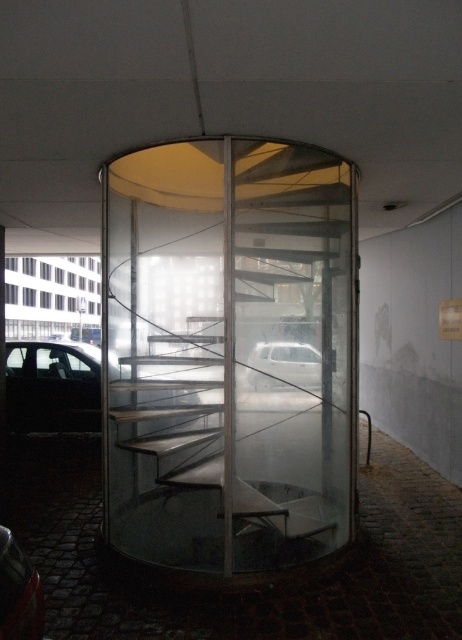
Question: Which object is positioned closest to the white matte car at center?

Choices:
 (A) transparent glass spiral staircase at center
 (B) matte black car at left
 (C) white glass parking garage at left

Answer: (B)

Question: Which object is farther from the camera taking this photo?

Choices:
 (A) matte black car at left
 (B) shiny red car at lower left
 (C) white matte car at center

Answer: (C)

Question: Can you confirm if transparent glass spiral staircase at center is bigger than shiny red car at lower left?

Choices:
 (A) no
 (B) yes

Answer: (B)

Question: Among these objects, which one is farthest from the camera?

Choices:
 (A) matte black car at left
 (B) shiny red car at lower left
 (C) white glass parking garage at left

Answer: (A)

Question: Does white glass parking garage at left appear on the right side of white matte car at center?

Choices:
 (A) no
 (B) yes

Answer: (A)

Question: Is matte black car at left to the right of white matte car at center from the viewer's perspective?

Choices:
 (A) no
 (B) yes

Answer: (A)